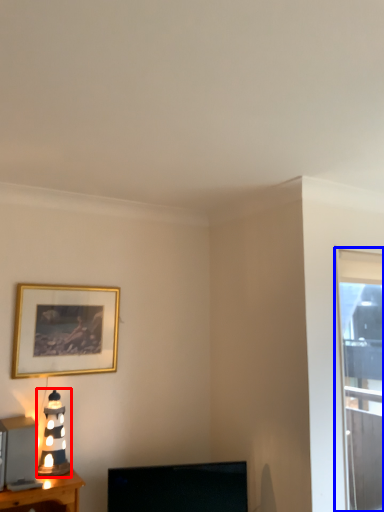
Question: Which point is further to the camera, table lamp (highlighted by a red box) or window (highlighted by a blue box)?

Choices:
 (A) table lamp
 (B) window

Answer: (B)